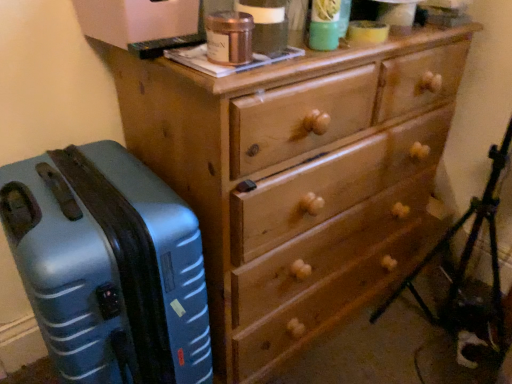
Where is `vacant area on top of blue matte suitcase at left (from a real-world perspective)`? vacant area on top of blue matte suitcase at left (from a real-world perspective) is located at coordinates 83,186.